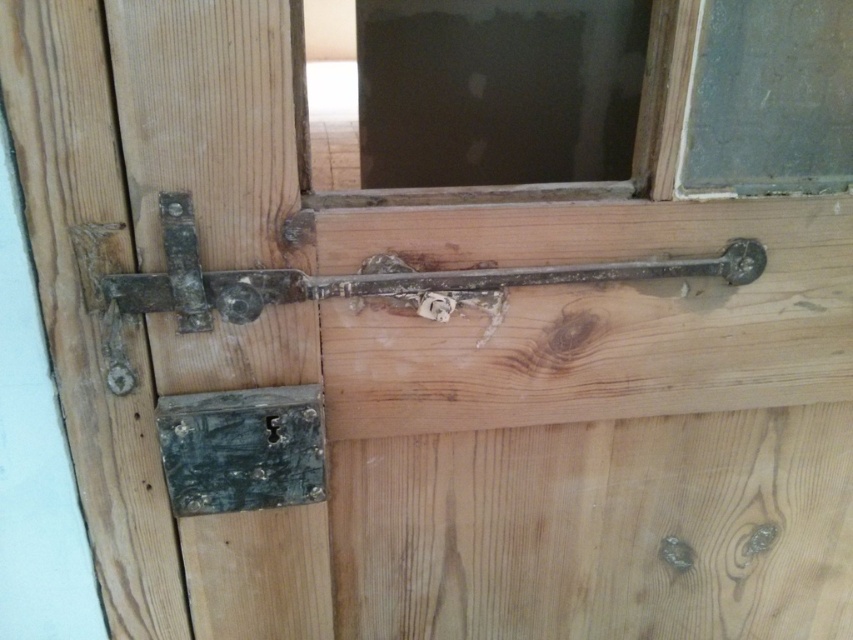
You are standing in front of the wooden door with the metal latch. You need to check if there is a transparent glass window at upper center at point 0.152, 0.889. Is there one?

Yes, there is a transparent glass window at upper center at point [757,97].

You are trying to determine if the transparent glass window at upper center can fit a new decorative frame that requires at least 10 cm in width. Given that the rusty metal lock at lower left is 5 cm wide, can the window accommodate the frame?

The transparent glass window at upper center is wider than the rusty metal lock at lower left, which is 5 cm wide. Since the window is larger in width, it can accommodate the decorative frame requiring at least 10 cm in width.